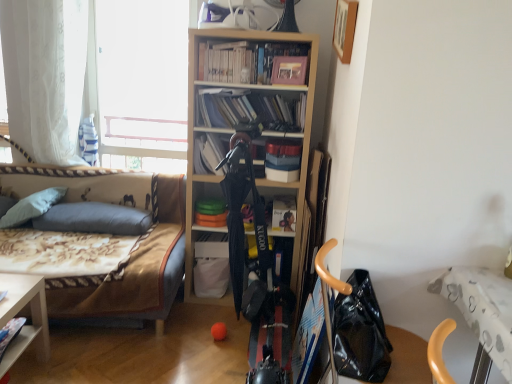
Question: Considering the relative positions of wooden picture frame at upper right and floral fabric couch at left in the image provided, is wooden picture frame at upper right to the left of floral fabric couch at left from the viewer's perspective?

Choices:
 (A) no
 (B) yes

Answer: (A)

Question: Could you tell me if wooden picture frame at upper right is facing floral fabric couch at left?

Choices:
 (A) yes
 (B) no

Answer: (B)

Question: Is wooden picture frame at upper right placed right next to floral fabric couch at left?

Choices:
 (A) no
 (B) yes

Answer: (A)

Question: Considering the relative positions of wooden picture frame at upper right and floral fabric couch at left in the image provided, is wooden picture frame at upper right behind floral fabric couch at left?

Choices:
 (A) yes
 (B) no

Answer: (B)

Question: Considering the relative sizes of wooden picture frame at upper right and floral fabric couch at left in the image provided, is wooden picture frame at upper right taller than floral fabric couch at left?

Choices:
 (A) no
 (B) yes

Answer: (A)

Question: Is matte plastic books at center, marked as the 2th book in a top-to-bottom arrangement, in front of or behind light wood bookcase at center in the image?

Choices:
 (A) behind
 (B) front

Answer: (A)

Question: In terms of height, does matte plastic books at center, which is counted as the 3th book, starting from the bottom, look taller or shorter compared to light wood bookcase at center?

Choices:
 (A) tall
 (B) short

Answer: (B)

Question: From the image's perspective, relative to light wood bookcase at center, is matte plastic books at center, which is counted as the 3th book, starting from the bottom, above or below?

Choices:
 (A) below
 (B) above

Answer: (B)

Question: Choose the correct answer: Is matte plastic books at center, marked as the 2th book in a top-to-bottom arrangement, inside light wood bookcase at center or outside it?

Choices:
 (A) outside
 (B) inside

Answer: (B)

Question: From the image's perspective, is matte black book at center, which ranks as the 3th book in top-to-bottom order, above or below matte gray pillow at left, which is counted as the first pillow, starting from the right?

Choices:
 (A) above
 (B) below

Answer: (A)

Question: Relative to matte gray pillow at left, which is counted as the first pillow, starting from the right, is matte black book at center, the second book positioned from the bottom, in front or behind?

Choices:
 (A) front
 (B) behind

Answer: (A)

Question: Is point (200, 135) closer or farther from the camera than point (97, 228)?

Choices:
 (A) closer
 (B) farther

Answer: (A)

Question: In terms of height, does matte black book at center, the second book positioned from the bottom, look taller or shorter compared to matte gray pillow at left, which is counted as the first pillow, starting from the right?

Choices:
 (A) tall
 (B) short

Answer: (A)

Question: Is white sheer curtain at left taller or shorter than white matte book at center, the fourth book positioned from the top?

Choices:
 (A) tall
 (B) short

Answer: (A)

Question: Considering the relative positions of white sheer curtain at left and white matte book at center, the fourth book positioned from the top, in the image provided, is white sheer curtain at left to the left or to the right of white matte book at center, the fourth book positioned from the top,?

Choices:
 (A) right
 (B) left

Answer: (B)